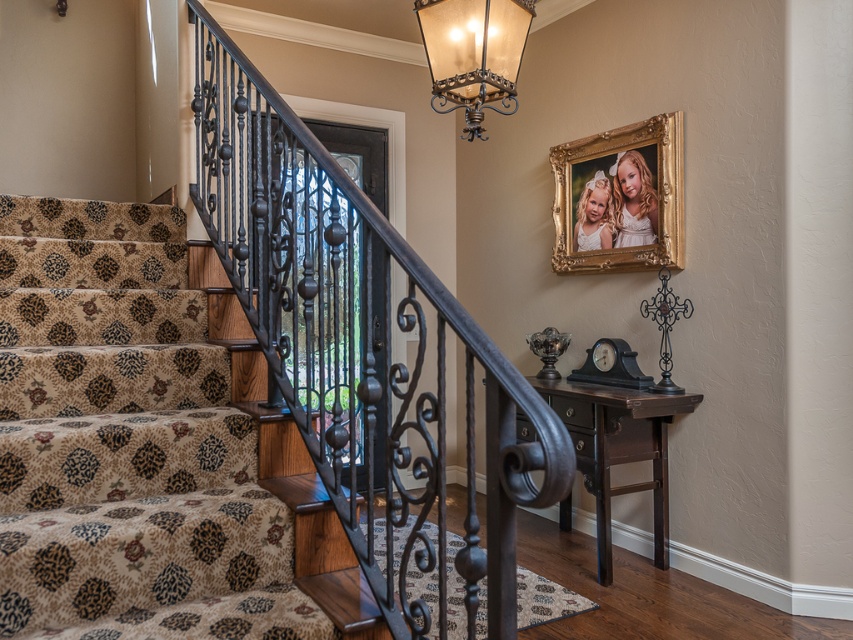
You are planning to place a new rectangular rug that is 3 feet wide in this space. The patterned carpet at left and the metallic brass lantern at upper center are already present. Which object should you avoid placing the rug near to ensure it doesn,t block the lantern?

The metallic brass lantern at upper center is narrower than the patterned carpet at left, so placing the rug near the metallic brass lantern at upper center would be safer to avoid blocking it. However, since the question states the patterned carpet at left might be wider, you should avoid placing the rug near the patterned carpet at left to prevent blocking the lantern.